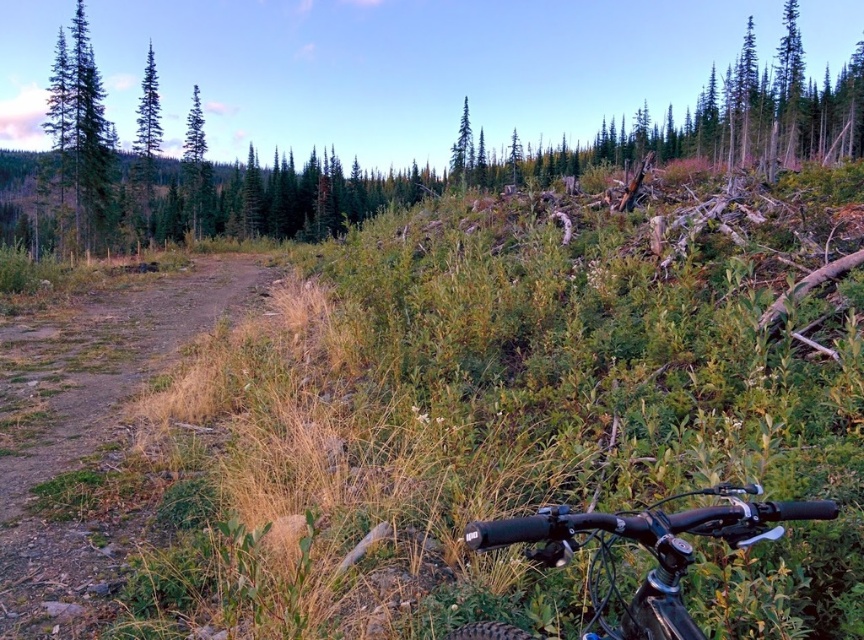
You are riding a mountain bike and looking ahead. You notice two green matte trees in the distance. One is at the upper left and the other at the upper center of your view. Which tree is positioned to the left when comparing the green matte tree at upper left and the green matte tree at upper center?

The green matte tree at upper left is positioned to the left of the green matte tree at upper center.